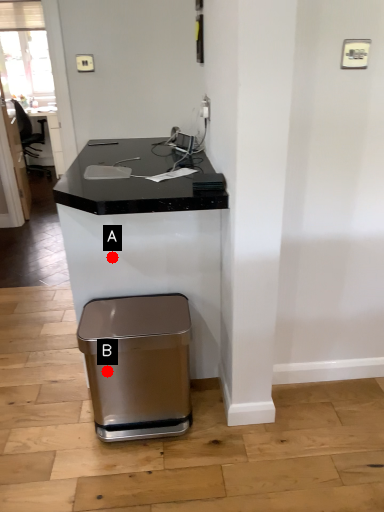
Question: Two points are circled on the image, labeled by A and B beside each circle. Among these points, which one is farthest from the camera?

Choices:
 (A) A is further
 (B) B is further

Answer: (A)